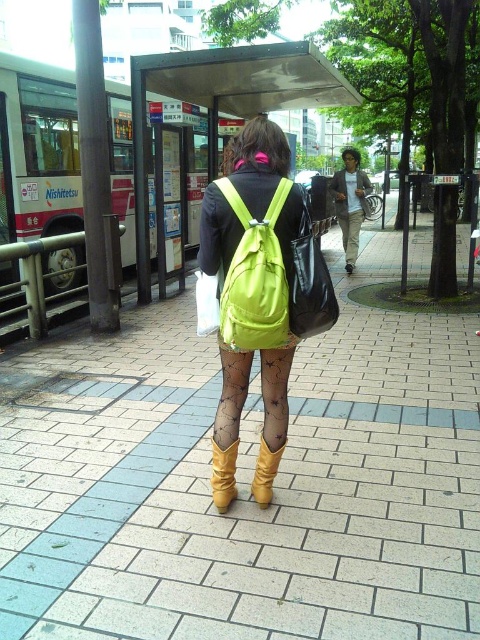
Does metallic silver bus stop at upper center lie behind leather high-heeled boot at center?

That is True.

Is metallic silver bus stop at upper center closer to the viewer compared to leather high-heeled boot at center?

No, it is behind leather high-heeled boot at center.

The width and height of the screenshot is (480, 640). Identify the location of metallic silver bus stop at upper center. (226, 100).

Can you confirm if light gray paving stone at center is thinner than leather high-heeled boot at center?

In fact, light gray paving stone at center might be wider than leather high-heeled boot at center.

Can you confirm if light gray paving stone at center is smaller than leather high-heeled boot at center?

Incorrect, light gray paving stone at center is not smaller in size than leather high-heeled boot at center.

The image size is (480, 640). What do you see at coordinates (248, 484) in the screenshot? I see `light gray paving stone at center` at bounding box center [248, 484].

At what (x,y) coordinates should I click in order to perform the action: click on light gray paving stone at center. Please return your answer as a coordinate pair (x, y). Looking at the image, I should click on (248, 484).

Is matte yellow boot at center taller than leather high-heeled boot at center?

Yes.

Between matte yellow boot at center and leather high-heeled boot at center, which one has less height?

leather high-heeled boot at center

The height and width of the screenshot is (640, 480). Describe the element at coordinates (224, 476) in the screenshot. I see `matte yellow boot at center` at that location.

I want to click on matte yellow boot at center, so click(x=224, y=476).